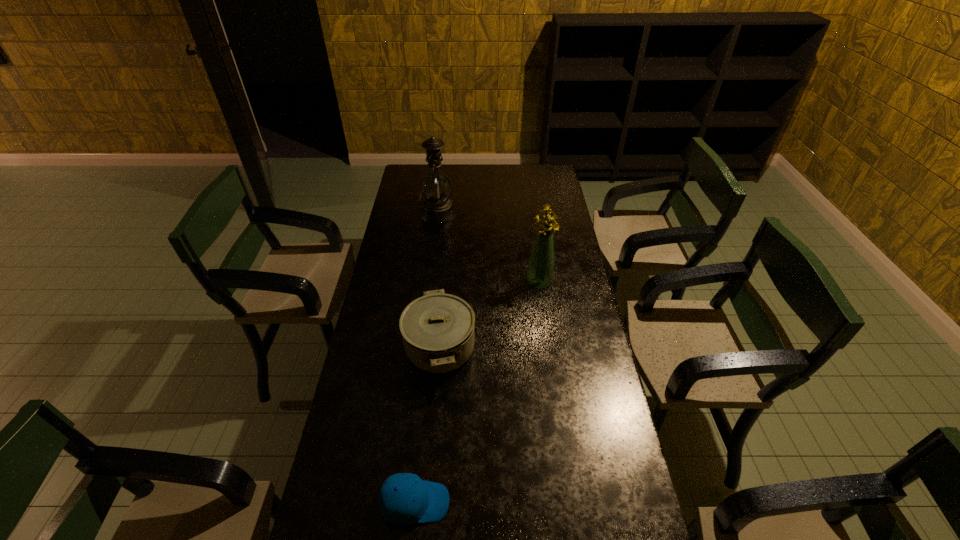
At what (x,y) coordinates should I click in order to perform the action: click on free point between the cap and the saucepan. Please return your answer as a coordinate pair (x, y). Looking at the image, I should click on (427, 426).

At what (x,y) coordinates should I click in order to perform the action: click on vacant region between the farthest object and the third nearest object. Please return your answer as a coordinate pair (x, y). Looking at the image, I should click on (489, 247).

Identify the location of vacant space that's between the bouquet and the shortest object. [477, 393].

The height and width of the screenshot is (540, 960). Find the location of `vacant area that lies between the cap and the third farthest object`. vacant area that lies between the cap and the third farthest object is located at coordinates (427, 426).

Image resolution: width=960 pixels, height=540 pixels. I want to click on vacant space in between the bouquet and the saucepan, so click(490, 316).

Identify the location of object identified as the third closest to the third farthest object. Image resolution: width=960 pixels, height=540 pixels. (436, 188).

I want to click on object that is the nearest to the shortest object, so click(437, 329).